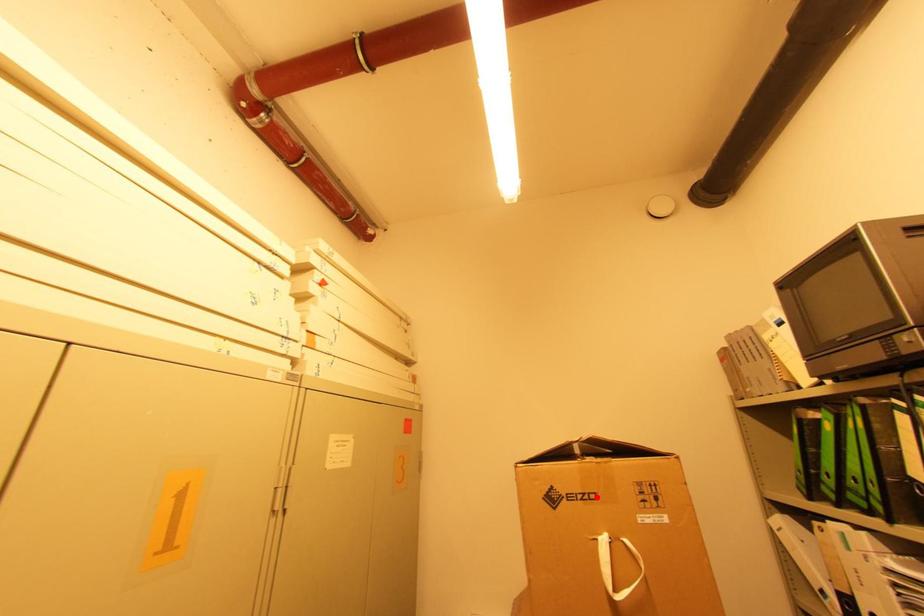
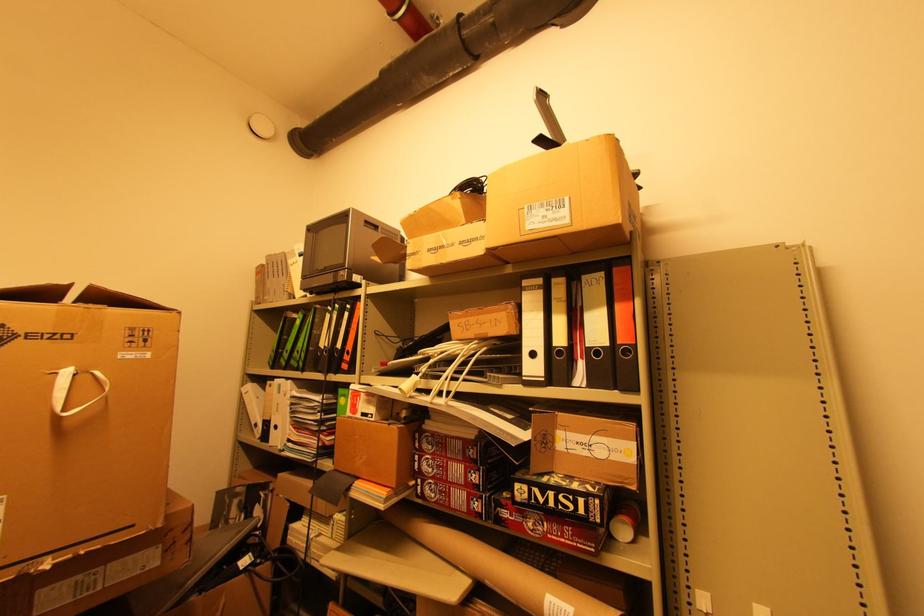
Locate, in the second image, the point that corresponds to the highlighted location in the first image.

(70, 338)